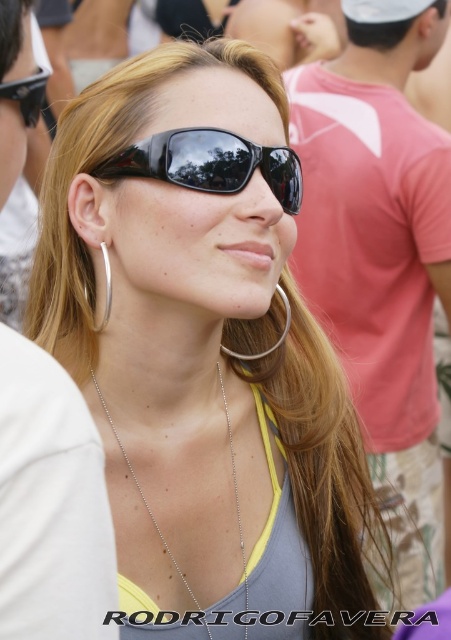
The woman in the image is wearing a necklace and sunglasses. The sunglasses are located at point [210,163]. If you were to draw a straight line from the necklace to the sunglasses, would it pass through any other objects mentioned in the scene?

The sunglasses at center are represented by the point [210,163]. Since the necklace is not listed in the objects and no other objects are mentioned besides the sunglasses, there are no other objects for the line to pass through.

You are a photographer trying to capture a closeup shot of the black plastic sunglasses at center and the silver metallic hoop at left. Since you want to focus on the sunglasses, which object should you ensure is closer to the camera lens?

The black plastic sunglasses at center has a larger size compared to the silver metallic hoop at left, so to focus on the sunglasses, you should ensure the black plastic sunglasses at center is closer to the camera lens.

Based on the photo, you are a photographer at a social event and want to capture a shot of the woman wearing the silver metallic hoop at left and the black plastic sunglasses at center. To ensure both items are in the frame, should you adjust your camera to focus more to the left or the right?

The black plastic sunglasses at center are to the right of the silver metallic hoop at left, so you should focus more to the left to include both items in the frame.